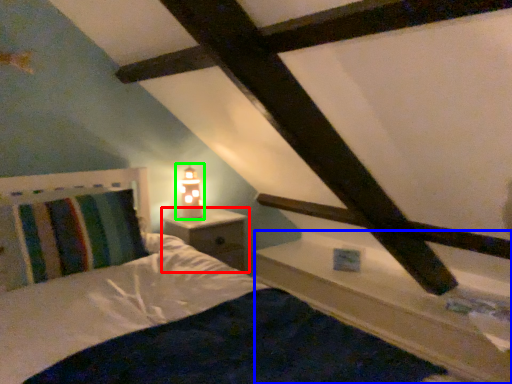
Question: Which object is positioned farthest from nightstand (highlighted by a red box)? Select from ledge (highlighted by a blue box) and table lamp (highlighted by a green box).

Choices:
 (A) ledge
 (B) table lamp

Answer: (A)